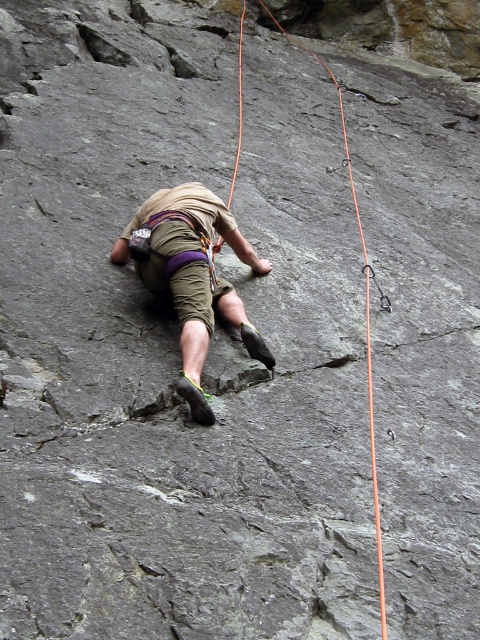
You are a rock climber preparing to secure your harness. You have two items in your view, the khaki cotton shorts at center and the orange nylon rope at upper center. Which item is thinner?

The khaki cotton shorts at center is thinner than the orange nylon rope at upper center.

You are a rock climber looking at the image. You need to secure your gear. Where should you place your khaki cotton shorts at center relative to the orange nylon rope at upper center?

The khaki cotton shorts at center should be placed below the orange nylon rope at upper center as per the image description.

You are a photographer observing the rock climber. You need to focus your camera on the khaki cotton shorts at center and orange nylon rope at upper center. Which object should you adjust your focus to first if you want to capture both in a single frame without moving the camera?

The khaki cotton shorts at center should be focused on first because it occupies less space than the orange nylon rope at upper center, allowing for better adjustment to include both in the frame.